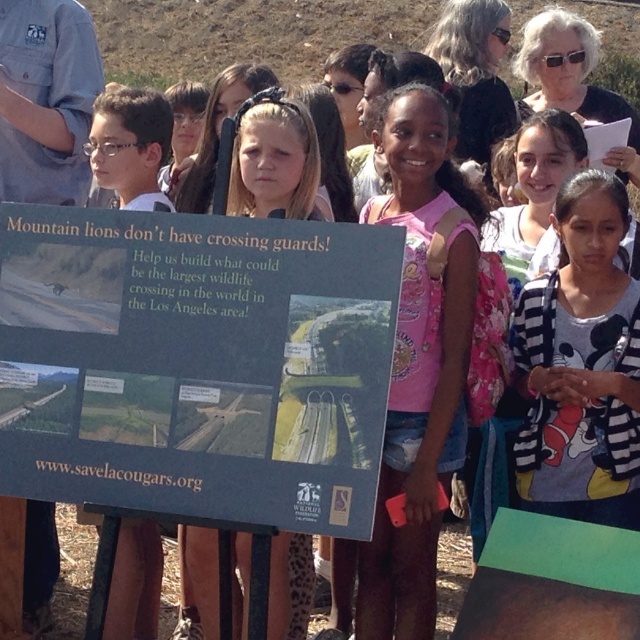
Who is taller, blue cardboard sign at center or white striped sweater at center?

Standing taller between the two is white striped sweater at center.

Is point (51, 234) in front of point (624, 449)?

Yes, point (51, 234) is closer to viewer.

Image resolution: width=640 pixels, height=640 pixels. What do you see at coordinates (196, 364) in the screenshot? I see `blue cardboard sign at center` at bounding box center [196, 364].

In order to click on blue cardboard sign at center in this screenshot , I will do `click(196, 364)`.

Locate an element on the screen. Image resolution: width=640 pixels, height=640 pixels. pink fabric shirt at center is located at coordinates (419, 365).

Which is more to the right, pink fabric shirt at center or white striped sweater at center?

From the viewer's perspective, white striped sweater at center appears more on the right side.

The image size is (640, 640). In order to click on pink fabric shirt at center in this screenshot , I will do `click(419, 365)`.

Who is more forward, (192, 424) or (365, 550)?

Point (192, 424)

What do you see at coordinates (196, 364) in the screenshot?
I see `blue cardboard sign at center` at bounding box center [196, 364].

Who is more distant from viewer, (1, 406) or (412, 246)?

The point (412, 246) is behind.

Image resolution: width=640 pixels, height=640 pixels. What are the coordinates of `blue cardboard sign at center` in the screenshot? It's located at (196, 364).